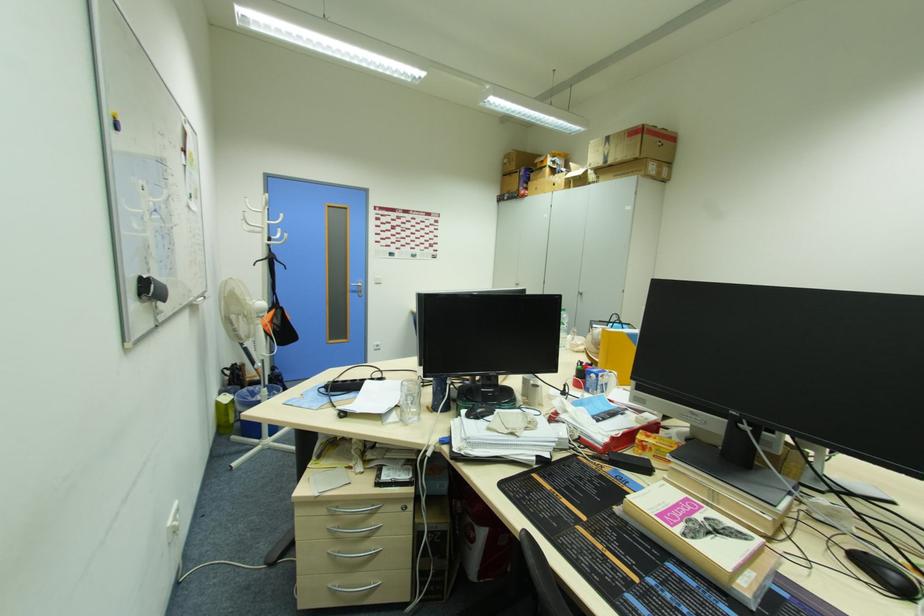
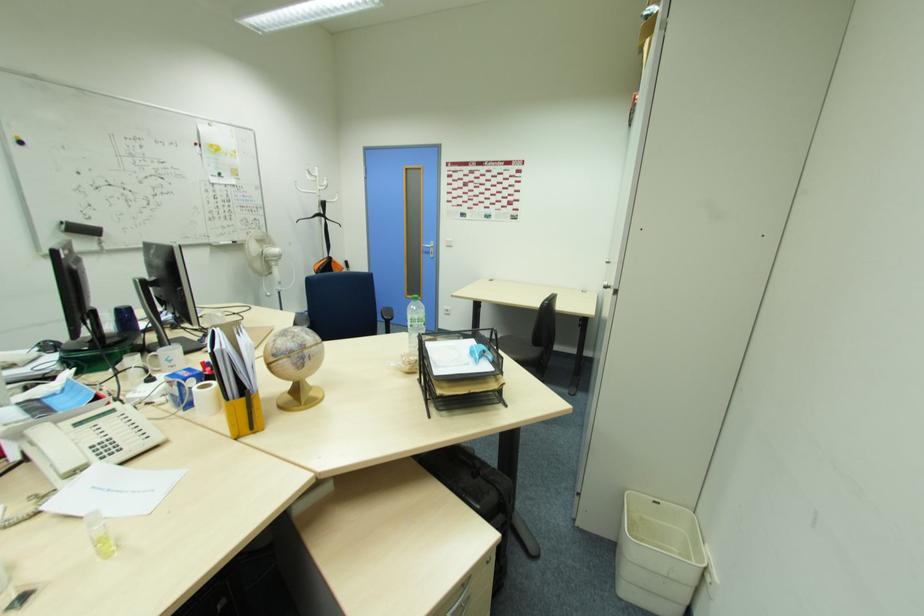
In the second image, find the point that corresponds to [358,291] in the first image.

(430, 252)